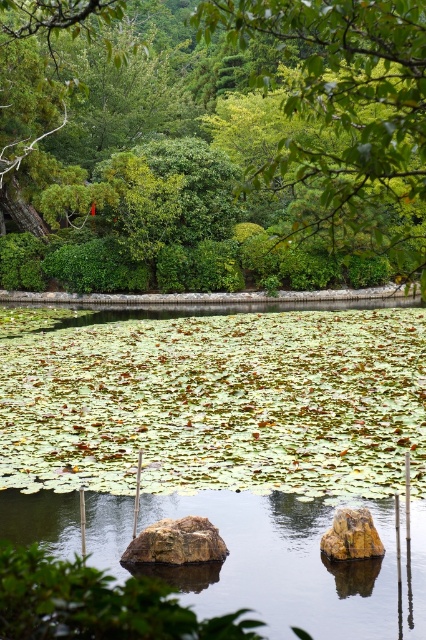
Does translucent water at center have a larger size compared to rusty metallic boulder at center?

Yes.

Where is `translucent water at center`? translucent water at center is located at coordinates (284, 564).

Where is `translucent water at center`? The image size is (426, 640). translucent water at center is located at coordinates (284, 564).

Who is lower down, green leafy tree at center or rusty metallic boulder at center?

rusty metallic boulder at center

Is point (22, 212) positioned before point (371, 548)?

No, it is behind (371, 548).

Between point (241, 93) and point (356, 529), which one is positioned behind?

Positioned behind is point (241, 93).

In order to click on green leafy tree at center in this screenshot , I will do `click(218, 136)`.

Which of these two, brown rough rock at center or rusty metallic boulder at center, stands shorter?

With less height is brown rough rock at center.

Where is `brown rough rock at center`? The image size is (426, 640). brown rough rock at center is located at coordinates (176, 541).